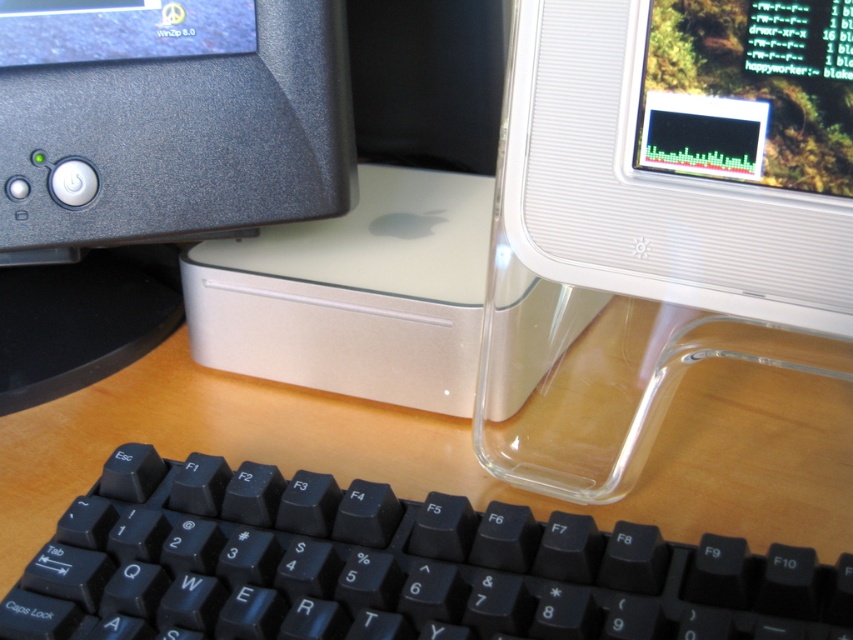
From the picture: Does matte black desktop computer at left have a greater width compared to white textured monitor at upper right?

Yes.

Between point (166, 250) and point (791, 324), which one is positioned in front?

Point (791, 324)

Is point (18, 387) farther from camera compared to point (577, 240)?

Yes, point (18, 387) is behind point (577, 240).

Find the location of a particular element. The image size is (853, 640). matte black desktop computer at left is located at coordinates (155, 180).

Does black plastic keyboard at lower center have a lesser width compared to matte black desktop computer at left?

Incorrect, black plastic keyboard at lower center's width is not less than matte black desktop computer at left's.

Is black plastic keyboard at lower center taller than matte black desktop computer at left?

No.

The height and width of the screenshot is (640, 853). In order to click on black plastic keyboard at lower center in this screenshot , I will do `click(389, 566)`.

At what (x,y) coordinates should I click in order to perform the action: click on black plastic keyboard at lower center. Please return your answer as a coordinate pair (x, y). The height and width of the screenshot is (640, 853). Looking at the image, I should click on (389, 566).

The image size is (853, 640). In order to click on black plastic keyboard at lower center in this screenshot , I will do (389, 566).

Does black plastic keyboard at lower center have a greater height compared to white textured monitor at upper right?

No, black plastic keyboard at lower center is not taller than white textured monitor at upper right.

Who is more forward, (341,536) or (598,106)?

Point (341,536)

You are a GUI agent. You are given a task and a screenshot of the screen. Output one action in this format:
    pyautogui.click(x=<x>, y=<y>)
    Task: Click on the black plastic keyboard at lower center
    Image resolution: width=853 pixels, height=640 pixels.
    Given the screenshot: What is the action you would take?
    pyautogui.click(x=389, y=566)